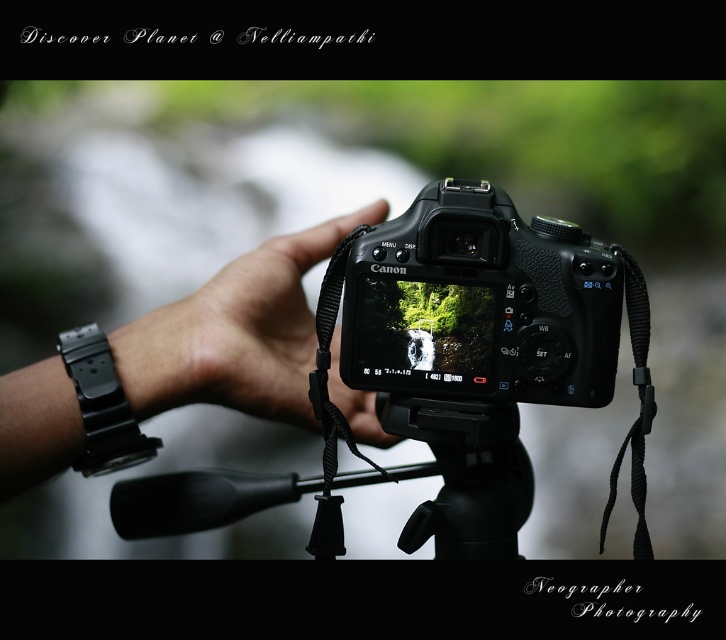
Question: Is black plastic camera at center to the left of black rubber tripod at center from the viewer's perspective?

Choices:
 (A) no
 (B) yes

Answer: (A)

Question: Which of the following is the closest to the observer?

Choices:
 (A) (468, 544)
 (B) (147, 397)

Answer: (A)

Question: Does black plastic camera at center lie behind black matte hand at center?

Choices:
 (A) no
 (B) yes

Answer: (A)

Question: Which of the following is the farthest from the observer?

Choices:
 (A) black matte hand at center
 (B) black rubber tripod at center
 (C) black plastic camera at center

Answer: (A)

Question: Considering the relative positions of black plastic camera at center and black matte hand at center in the image provided, where is black plastic camera at center located with respect to black matte hand at center?

Choices:
 (A) left
 (B) right

Answer: (B)

Question: Which point is closer to the camera?

Choices:
 (A) (348, 413)
 (B) (513, 266)
 (C) (515, 460)

Answer: (B)